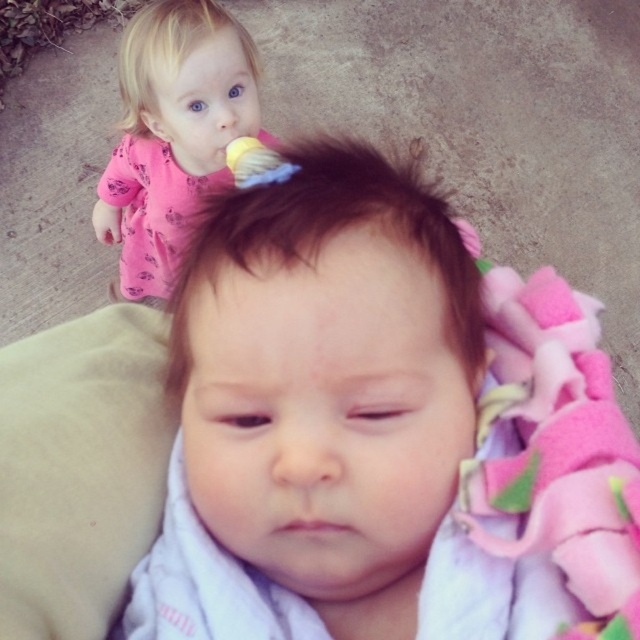
You are a photographer trying to capture a closeup of the baby lying down in the foreground. You have two points marked in the image, point A at coordinates point (435, 413) and point B at coordinates point (224, 161). Which point should you focus on to ensure the baby is in focus?

Point A at coordinates point (435, 413) is closer to the camera than point B at coordinates point (224, 161), so focusing on point A will ensure the baby lying down in the foreground is in focus.

You are a parent trying to cover both children with the available pink fabrics. Given that the soft pink blanket at center is smaller than the pink fabric at upper left, which fabric should you use to cover the baby lying at the center more effectively?

The soft pink blanket at center is smaller than the pink fabric at upper left, so the pink fabric at upper left should be used to cover the baby lying at the center more effectively because it is larger.

You are a photographer standing in front of the scene. You want to capture a closeup shot of the soft pink blanket at center without moving any objects. Can you get close enough to focus on it clearly?

The soft pink blanket at center is 33.09 centimeters away from viewer, so yes, you can get close enough to focus on it clearly as most cameras can focus within that distance.